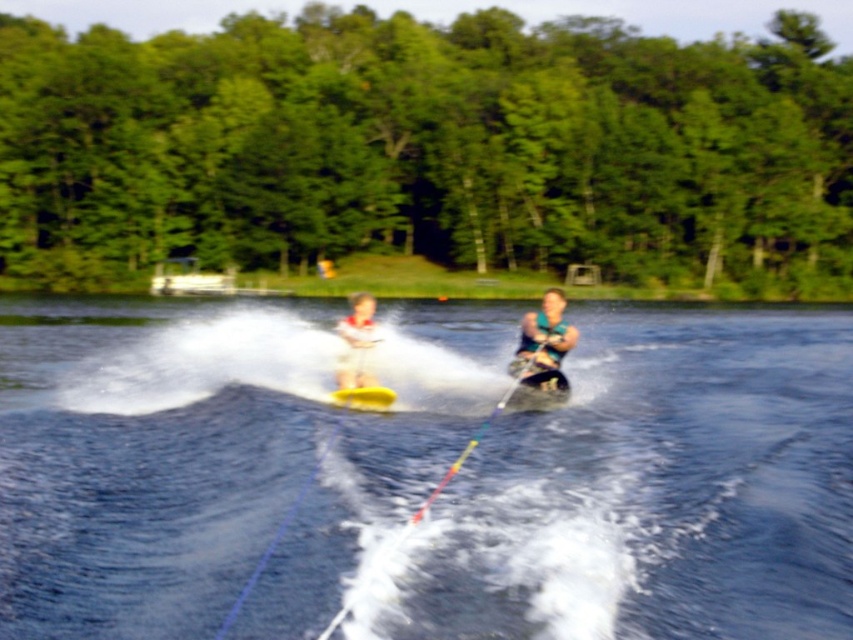
Does white plastic boat at upper center lie behind yellow rubber water ski at center?

Yes.

Find the location of a particular element. The height and width of the screenshot is (640, 853). white plastic boat at upper center is located at coordinates (189, 278).

Does green leafy trees at upper center have a lesser height compared to white matte life vest at center?

Incorrect, green leafy trees at upper center's height does not fall short of white matte life vest at center's.

Is green leafy trees at upper center further to the viewer compared to white matte life vest at center?

Yes, it is behind white matte life vest at center.

Find the location of a particular element. green leafy trees at upper center is located at coordinates (428, 148).

Find the location of a particular element. green leafy trees at upper center is located at coordinates (428, 148).

Can you confirm if blue water at center is smaller than yellow rubber water ski at center?

Incorrect, blue water at center is not smaller in size than yellow rubber water ski at center.

Between blue water at center and yellow rubber water ski at center, which one appears on the right side from the viewer's perspective?

blue water at center is more to the right.

Identify the location of blue water at center. This screenshot has width=853, height=640. (213, 458).

The height and width of the screenshot is (640, 853). I want to click on blue water at center, so click(x=213, y=458).